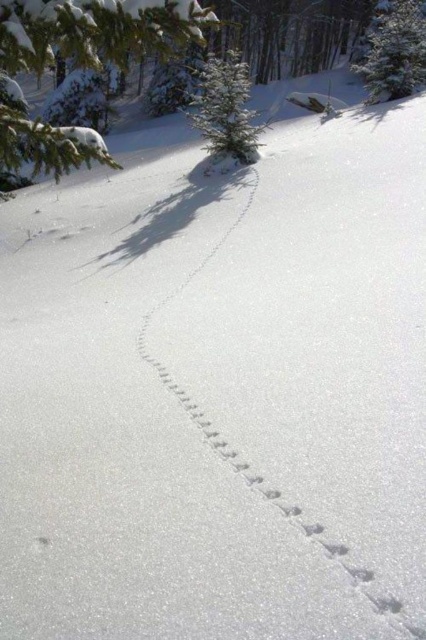
You are a wildlife photographer wanting to capture both the green textured pine branch at upper left and the green textured pine tree at upper right in a single frame. Given that your camera has a 50mm lens, which has a field of view of approximately 46 degrees, can you determine if both objects will fit in the frame from your current position?

The green textured pine branch at upper left and green textured pine tree at upper right are 15.37 meters apart from each other. With a 50mm lens providing a 46 degree field of view, the distance between the two objects exceeds the lens capacity to capture both in a single frame from your current position.

You are an animal tracker analyzing the winter scene. You notice the footprints leading towards the green textured pine branch at upper left. Where would you expect the animal to have been heading?

The footprints lead towards the green textured pine branch at upper left, so the animal was heading in the direction of the green textured pine branch at upper left.

You are standing at the bottom right corner of the snowy landscape and notice the trail of footprints leading diagonally towards the upper left. There is also a green textured pine tree at upper right. Based on their positions, which object is closer to your current location?

The trail of footprints is closer to your current location because the footprints start at the bottom right corner where you are standing, while the green textured pine tree at upper right is located further away at point (394, 51).